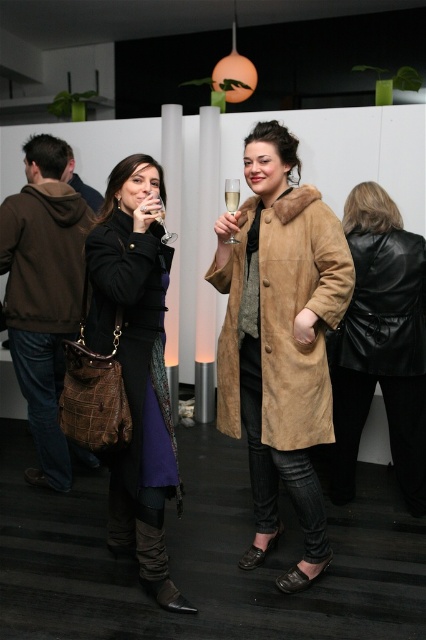
Can you confirm if brown suede hoodie at left is thinner than clear glass at upper center?

Incorrect, brown suede hoodie at left's width is not less than clear glass at upper center's.

Is brown suede hoodie at left closer to the viewer compared to clear glass at upper center?

No, it is not.

Is point (20, 368) behind point (227, 188)?

Yes, point (20, 368) is behind point (227, 188).

Identify the location of brown suede hoodie at left. Image resolution: width=426 pixels, height=640 pixels. (43, 292).

Between black leather coat at center and brown suede hoodie at left, which one is positioned lower?

black leather coat at center

Does point (376, 218) lie in front of point (54, 353)?

That is True.

Is point (351, 376) positioned after point (51, 282)?

That is True.

You are a GUI agent. You are given a task and a screenshot of the screen. Output one action in this format:
    pyautogui.click(x=<x>, y=<y>)
    Task: Click on the black leather coat at center
    The image size is (426, 640).
    Given the screenshot: What is the action you would take?
    pyautogui.click(x=380, y=346)

Image resolution: width=426 pixels, height=640 pixels. What do you see at coordinates (137, 365) in the screenshot?
I see `matte black coat at center` at bounding box center [137, 365].

Which is more to the left, matte black coat at center or clear glass at upper center?

matte black coat at center is more to the left.

Who is more forward, (160, 435) or (224, 200)?

Point (160, 435) is more forward.

This screenshot has height=640, width=426. Identify the location of matte black coat at center. (137, 365).